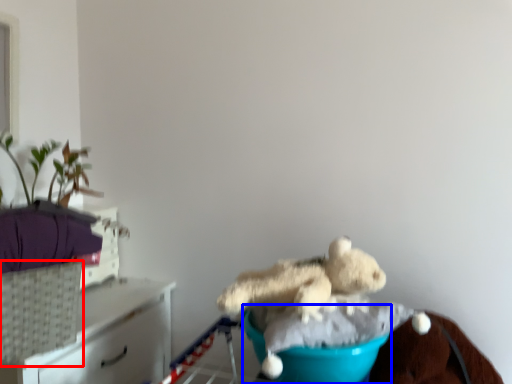
Question: Which point is further to the camera, basket (highlighted by a red box) or teal (highlighted by a blue box)?

Choices:
 (A) basket
 (B) teal

Answer: (A)